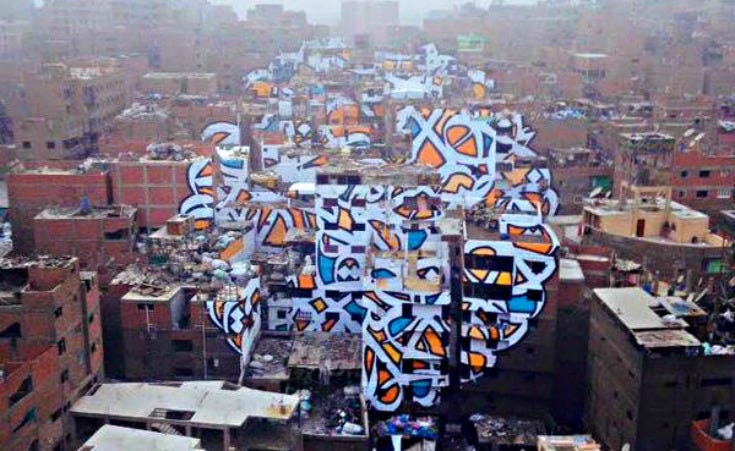
Image resolution: width=735 pixels, height=451 pixels. In order to click on orange art in this screenshot , I will do `click(458, 133)`.